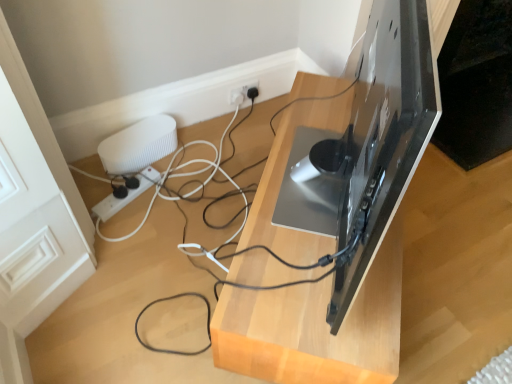
Identify the location of free space in front of white ribbed speaker at left. (141, 203).